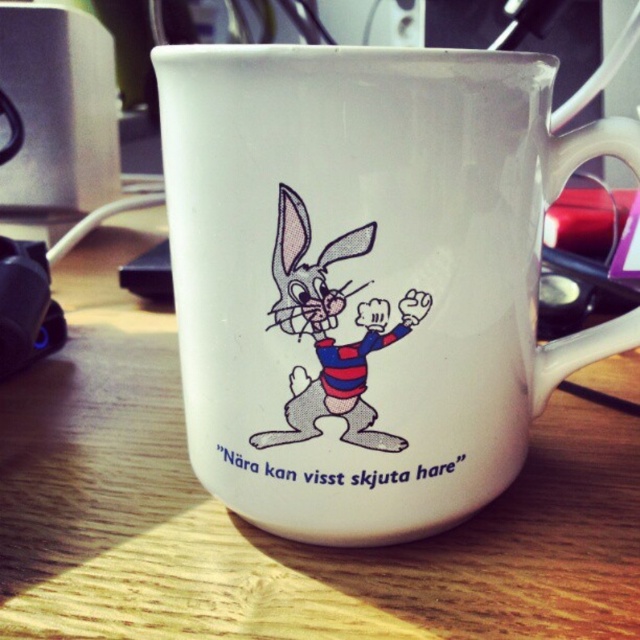
You are standing in front of the wooden table at center and the cartoon rabbit at center. Which object is closer to you?

The wooden table at center is closer to you because it is further to the viewer than the cartoon rabbit at center.

You are arranging a cozy study area and have a wooden table at center and a cartoon rabbit at center. Which object is positioned to the right side?

The cartoon rabbit at center is positioned to the right of the wooden table at center, so the cartoon rabbit at center is on the right side.

What is the spatial relationship between the white ceramic mug at center and the cartoon rabbit at center?

The white ceramic mug at center is to the right of the cartoon rabbit at center.